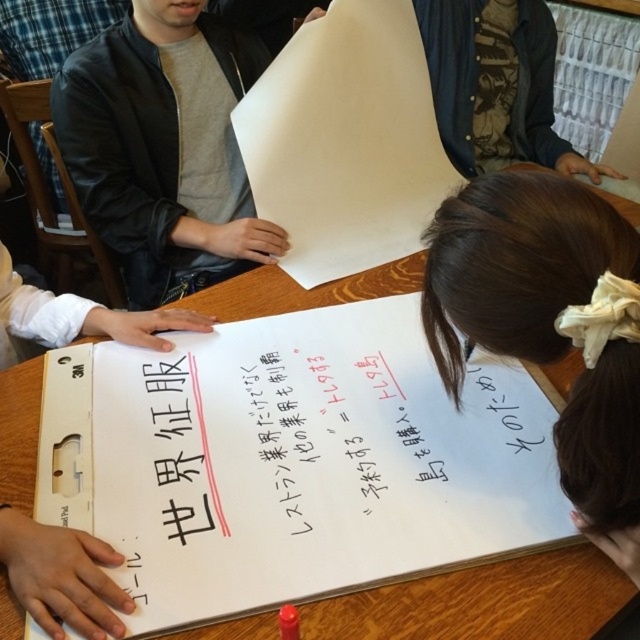
You are organizing a meeting and need to place a 15 cm tall document on the table. You have two options from the image, the white paper at lower right and the white paper at center. Which one can accommodate the document without covering the whiteboard?

The white paper at center has a greater height than the white paper at lower right. Since the document is 15 cm tall, the white paper at center can accommodate it without covering the whiteboard.

You are organizing a meeting and need to place two white papers on the table. The white paper at lower right and the white paper at center are already placed. Which white paper is to the right of the other?

The white paper at lower right is positioned on the right side of white paper at center.